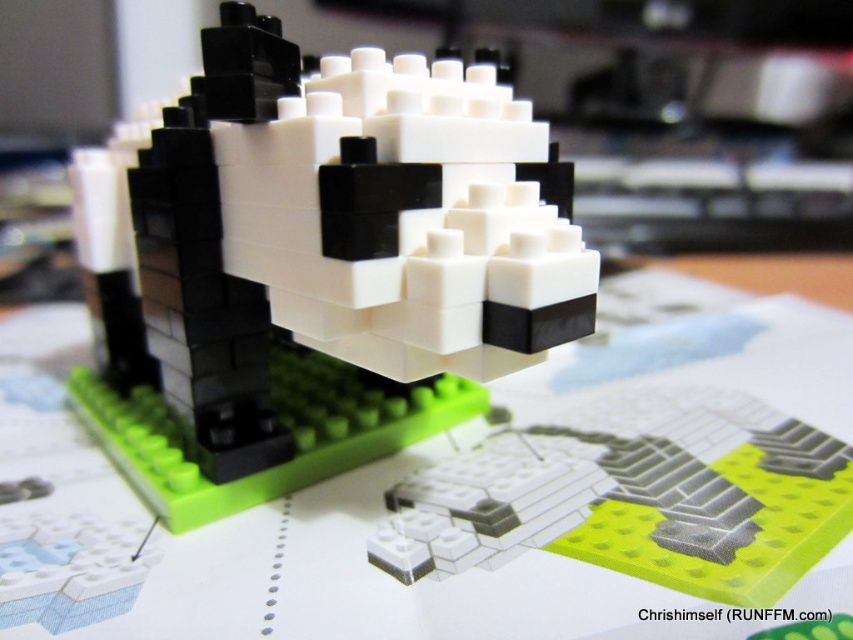
Does green plastic table at center lie behind black matte lego dog at center?

No, green plastic table at center is closer to the viewer.

Where is `green plastic table at center`? green plastic table at center is located at coordinates (457, 492).